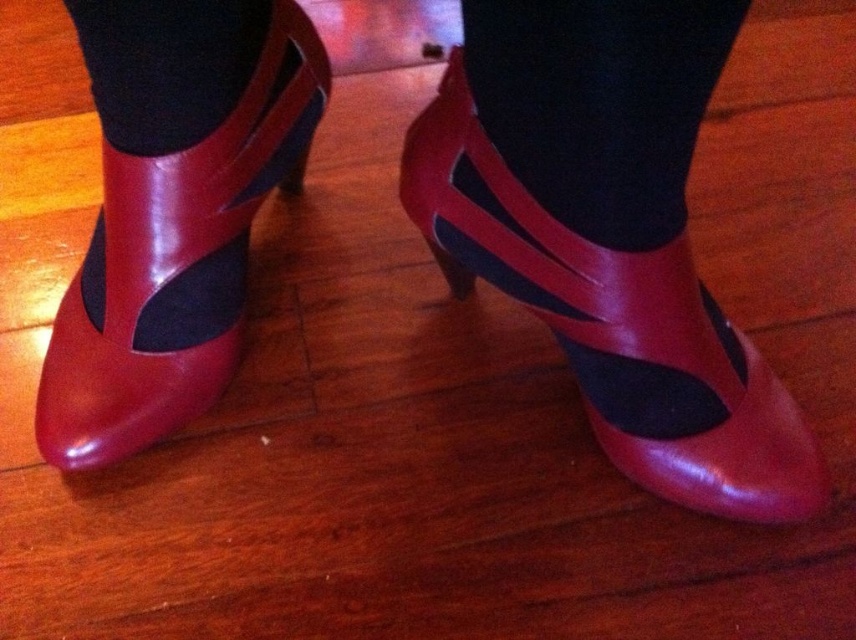
Can you confirm if shiny red leather shoe at center is shorter than black smooth sock at upper left?

Incorrect, shiny red leather shoe at center's height does not fall short of black smooth sock at upper left's.

How distant is shiny red leather shoe at center from black smooth sock at upper left?

The distance of shiny red leather shoe at center from black smooth sock at upper left is 41.41 centimeters.

Find the location of a particular element. shiny red leather shoe at center is located at coordinates (615, 326).

Looking at this image, is black matte sock at center above black smooth sock at upper left?

Actually, black matte sock at center is below black smooth sock at upper left.

Is black matte sock at center closer to camera compared to black smooth sock at upper left?

Yes.

Which is in front, point (569, 4) or point (122, 88)?

Positioned in front is point (569, 4).

You are a GUI agent. You are given a task and a screenshot of the screen. Output one action in this format:
    pyautogui.click(x=<x>, y=<y>)
    Task: Click on the black matte sock at center
    
    Given the screenshot: What is the action you would take?
    pyautogui.click(x=599, y=104)

Can you confirm if shiny red leather shoe at center is shorter than shiny leather boot at left?

Correct, shiny red leather shoe at center is not as tall as shiny leather boot at left.

Does shiny red leather shoe at center have a greater height compared to shiny leather boot at left?

Incorrect, shiny red leather shoe at center's height is not larger of shiny leather boot at left's.

What do you see at coordinates (615, 326) in the screenshot? The height and width of the screenshot is (640, 856). I see `shiny red leather shoe at center` at bounding box center [615, 326].

The height and width of the screenshot is (640, 856). I want to click on shiny red leather shoe at center, so click(x=615, y=326).